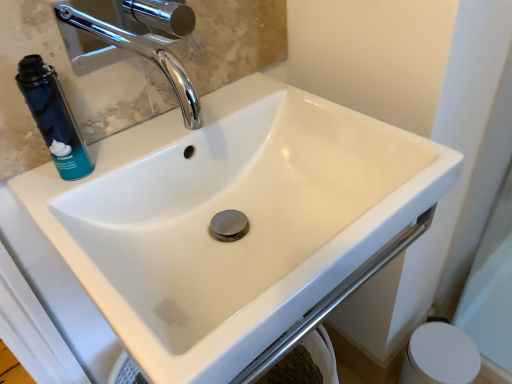
Locate an element on the screen. The height and width of the screenshot is (384, 512). free space to the right of blue matte can at upper left is located at coordinates (160, 148).